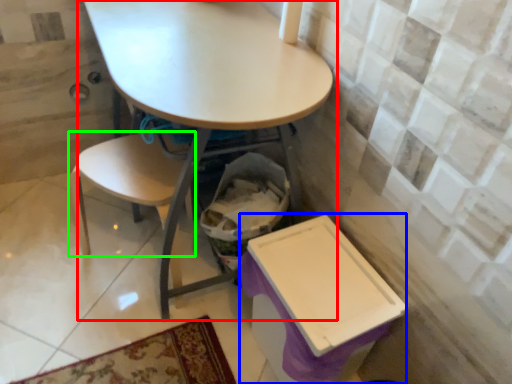
Question: Considering the real-world distances, which object is farthest from table (highlighted by a red box)? box (highlighted by a blue box) or chair (highlighted by a green box)?

Choices:
 (A) box
 (B) chair

Answer: (A)